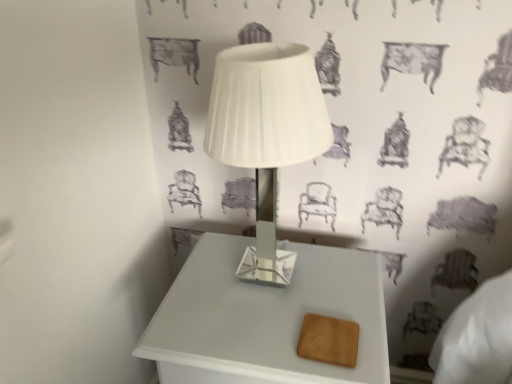
Where is `free location to the right of white glossy lamp at center`? The height and width of the screenshot is (384, 512). free location to the right of white glossy lamp at center is located at coordinates (350, 284).